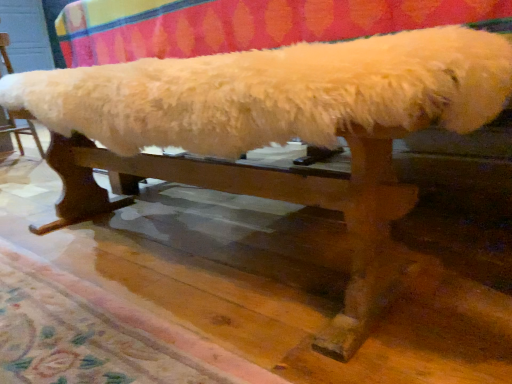
This screenshot has height=384, width=512. Describe the element at coordinates (80, 335) in the screenshot. I see `carpeted floor at lower center` at that location.

This screenshot has width=512, height=384. I want to click on carpeted floor at lower center, so click(x=80, y=335).

You are a GUI agent. You are given a task and a screenshot of the screen. Output one action in this format:
    pyautogui.click(x=<x>, y=<y>)
    Task: Click on the white fluffy bench at upper center
    The image size is (512, 384).
    Given the screenshot: What is the action you would take?
    pyautogui.click(x=21, y=130)

The width and height of the screenshot is (512, 384). Describe the element at coordinates (21, 130) in the screenshot. I see `white fluffy bench at upper center` at that location.

Where is `carpeted floor at lower center`? carpeted floor at lower center is located at coordinates (80, 335).

Is carpeted floor at lower center to the right of white fluffy bench at upper center from the viewer's perspective?

Indeed, carpeted floor at lower center is positioned on the right side of white fluffy bench at upper center.

Is the position of carpeted floor at lower center more distant than that of white fluffy bench at upper center?

No, it is not.

Is point (126, 323) positioned before point (1, 59)?

Yes, point (126, 323) is in front of point (1, 59).

From the image's perspective, is carpeted floor at lower center over white fluffy bench at upper center?

Actually, carpeted floor at lower center appears below white fluffy bench at upper center in the image.

From a real-world perspective, is carpeted floor at lower center physically below white fluffy bench at upper center?

Yes, from a real-world perspective, carpeted floor at lower center is beneath white fluffy bench at upper center.

Can you confirm if carpeted floor at lower center is wider than white fluffy bench at upper center?

Yes.

Looking at this image, does carpeted floor at lower center have a lesser height compared to white fluffy bench at upper center?

Correct, carpeted floor at lower center is not as tall as white fluffy bench at upper center.

Is carpeted floor at lower center bigger or smaller than white fluffy bench at upper center?

carpeted floor at lower center is smaller than white fluffy bench at upper center.

Do you think carpeted floor at lower center is within white fluffy bench at upper center, or outside of it?

carpeted floor at lower center is not enclosed by white fluffy bench at upper center.

Is carpeted floor at lower center placed right next to white fluffy bench at upper center?

carpeted floor at lower center and white fluffy bench at upper center are not in contact.

Is carpeted floor at lower center looking in the opposite direction of white fluffy bench at upper center?

No, carpeted floor at lower center's orientation is not away from white fluffy bench at upper center.

Can you tell me how much carpeted floor at lower center and white fluffy bench at upper center differ in facing direction?

179 degrees.

How distant is carpeted floor at lower center from white fluffy bench at upper center?

The distance of carpeted floor at lower center from white fluffy bench at upper center is 2.18 meters.

Where is `mat on the right of white fluffy bench at upper center`? Image resolution: width=512 pixels, height=384 pixels. mat on the right of white fluffy bench at upper center is located at coordinates (80, 335).

Is white fluffy bench at upper center to the left or to the right of carpeted floor at lower center in the image?

In the image, white fluffy bench at upper center appears on the left side of carpeted floor at lower center.

Between white fluffy bench at upper center and carpeted floor at lower center, which one is positioned in front?

carpeted floor at lower center is closer to the camera.

Is point (26, 128) closer to viewer compared to point (145, 351)?

No, it is behind (145, 351).

From the image's perspective, who appears lower, white fluffy bench at upper center or carpeted floor at lower center?

From the image's view, carpeted floor at lower center is below.

From a real-world perspective, is white fluffy bench at upper center physically below carpeted floor at lower center?

No.

Which object is wider, white fluffy bench at upper center or carpeted floor at lower center?

With larger width is carpeted floor at lower center.

Is white fluffy bench at upper center taller or shorter than carpeted floor at lower center?

Considering their sizes, white fluffy bench at upper center has more height than carpeted floor at lower center.

Which of these two, white fluffy bench at upper center or carpeted floor at lower center, is bigger?

With larger size is white fluffy bench at upper center.

Does white fluffy bench at upper center contain carpeted floor at lower center?

Actually, carpeted floor at lower center is outside white fluffy bench at upper center.

Are white fluffy bench at upper center and carpeted floor at lower center far apart?

Yes, white fluffy bench at upper center and carpeted floor at lower center are located far from each other.

Is white fluffy bench at upper center facing away from carpeted floor at lower center?

No, white fluffy bench at upper center is not facing the opposite direction of carpeted floor at lower center.

Locate an element on the screen. mat located on the right of white fluffy bench at upper center is located at coordinates (80, 335).

I want to click on furniture located above the carpeted floor at lower center (from a real-world perspective), so click(21, 130).

Where is `furniture above the carpeted floor at lower center (from the image's perspective)`? furniture above the carpeted floor at lower center (from the image's perspective) is located at coordinates (21, 130).